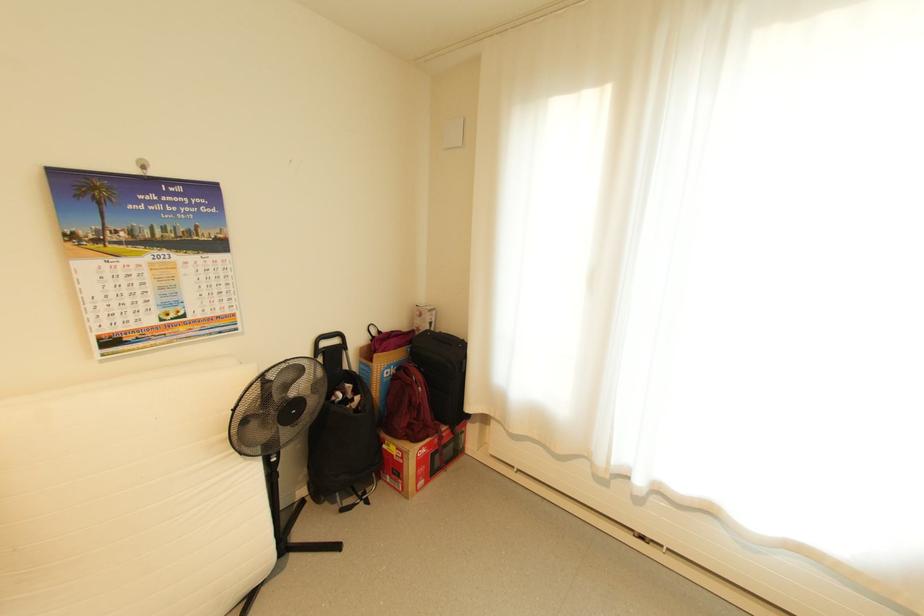
What are the coordinates of `black suitcase handle` in the screenshot? It's located at tap(441, 339).